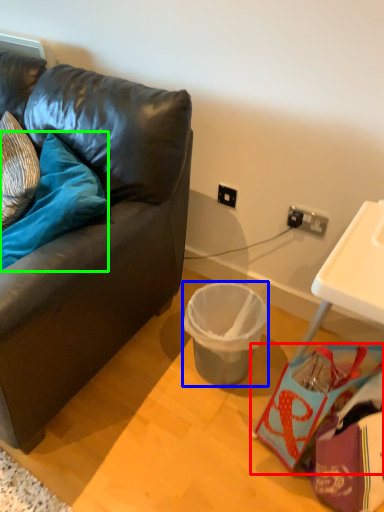
Question: Estimate the real-world distances between objects in this image. Which object is closer to handbag (highlighted by a red box), trash bin/can (highlighted by a blue box) or pillow (highlighted by a green box)?

Choices:
 (A) trash bin/can
 (B) pillow

Answer: (A)